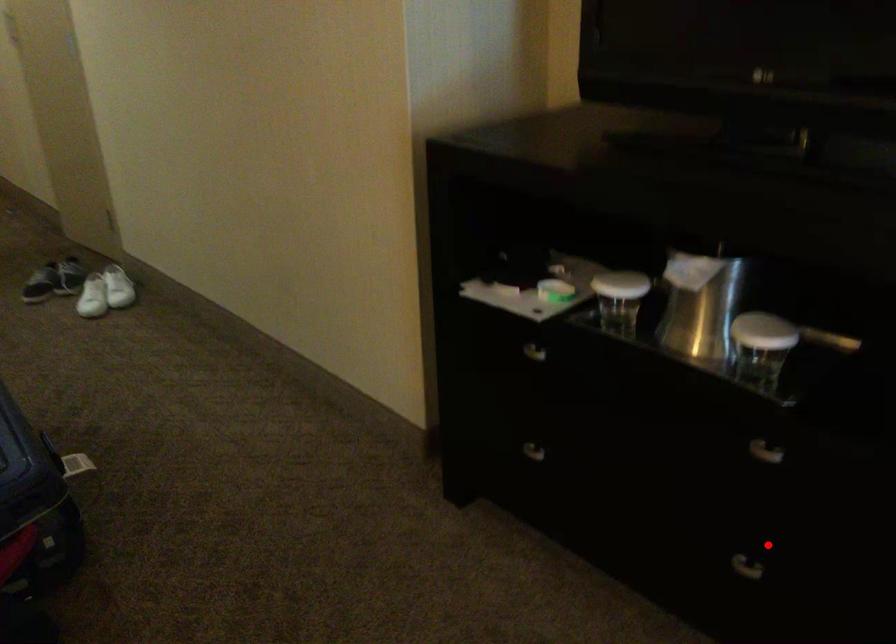
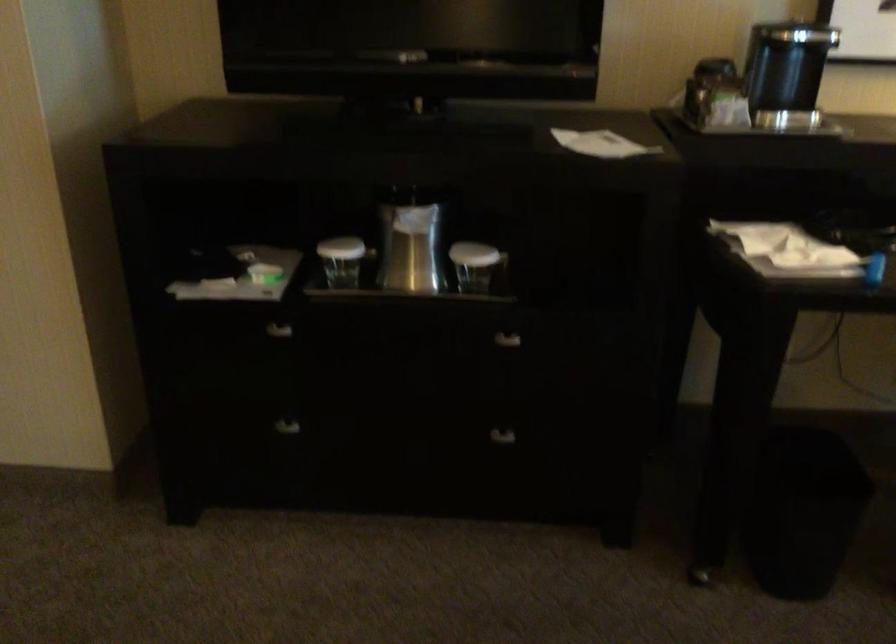
Question: I am providing you with two images of the same scene from different viewpoints. Image1 has a red point marked. In image2, the corresponding 3D location appears at what relative position? Reply with the corresponding letter.

Choices:
 (A) Closer
 (B) Farther

Answer: (B)